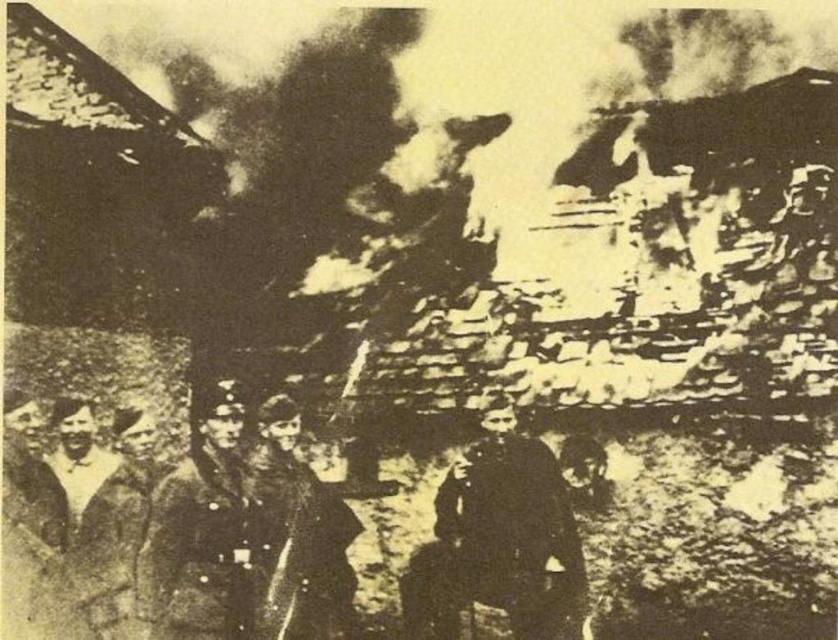
You are a photographer trying to capture a closeup of the dark gray uniform at center and dark gray fur coat at center in the historical photograph. Given that your camera can only focus on objects within 15 inches of each other, will you be able to capture both in a single focused shot?

The distance between the dark gray uniform at center and dark gray fur coat at center is 18.48 inches. Since your camera requires objects to be within 15 inches of each other for focus, you won t be able to capture both in a single focused shot.

You are a historian analyzing this historical photograph. You notice two points marked in the image. The first point is at coordinate point (275, 627) and the second is at point (128, 598). Based on their positions, which point is closer to the front of the image?

Point (275, 627) is in front of point (128, 598), so it is closer to the front of the image.